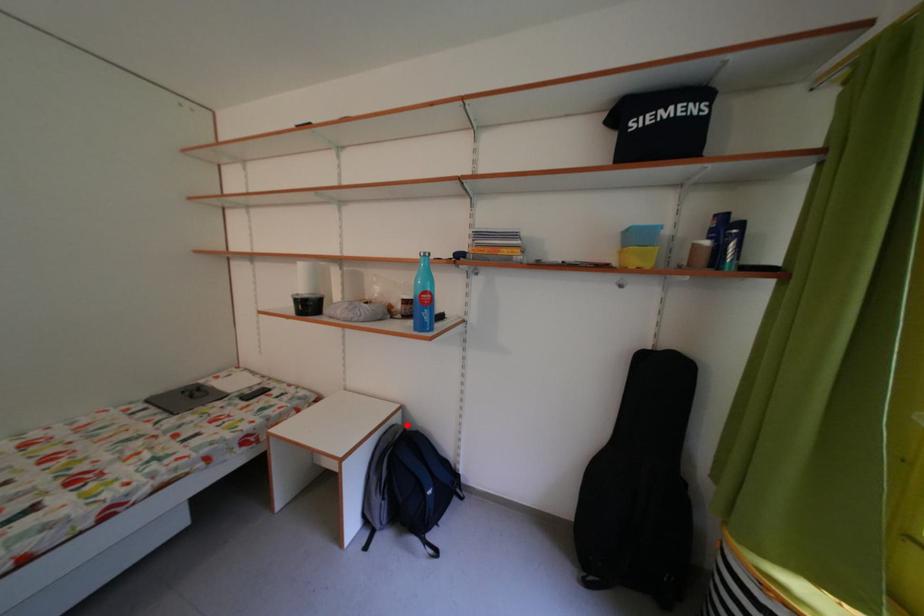
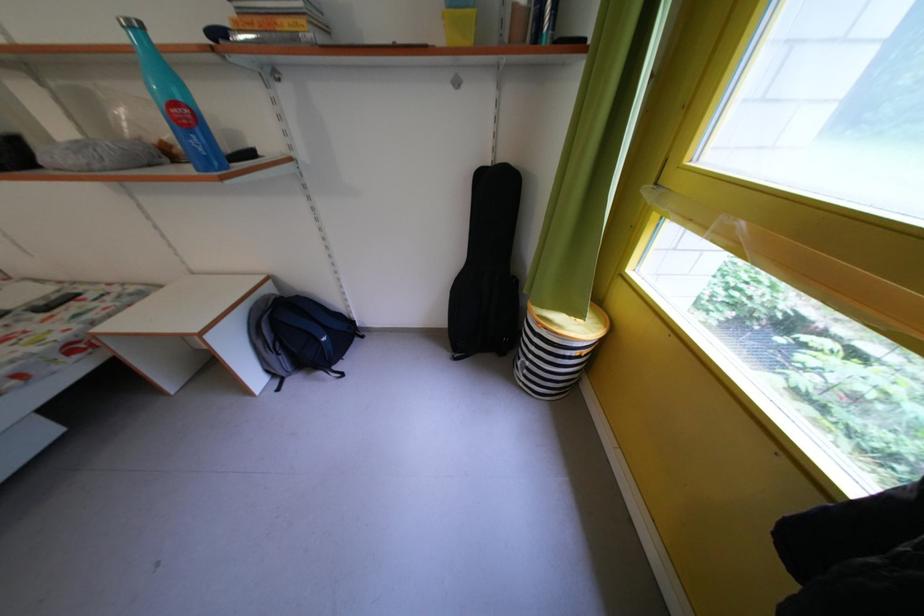
Locate, in the second image, the point that corresponds to the highlighted location in the first image.

(278, 296)